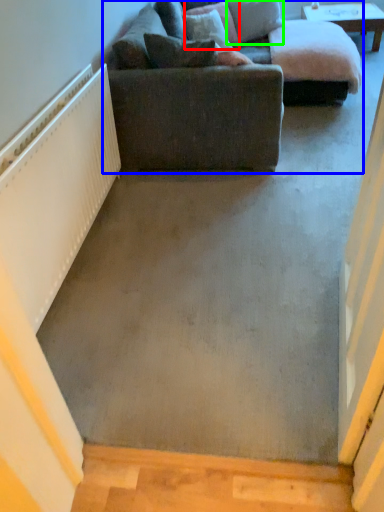
Question: Based on their relative distances, which object is farther from pillow (highlighted by a red box)? Choose from studio couch (highlighted by a blue box) and pillow (highlighted by a green box).

Choices:
 (A) studio couch
 (B) pillow

Answer: (A)